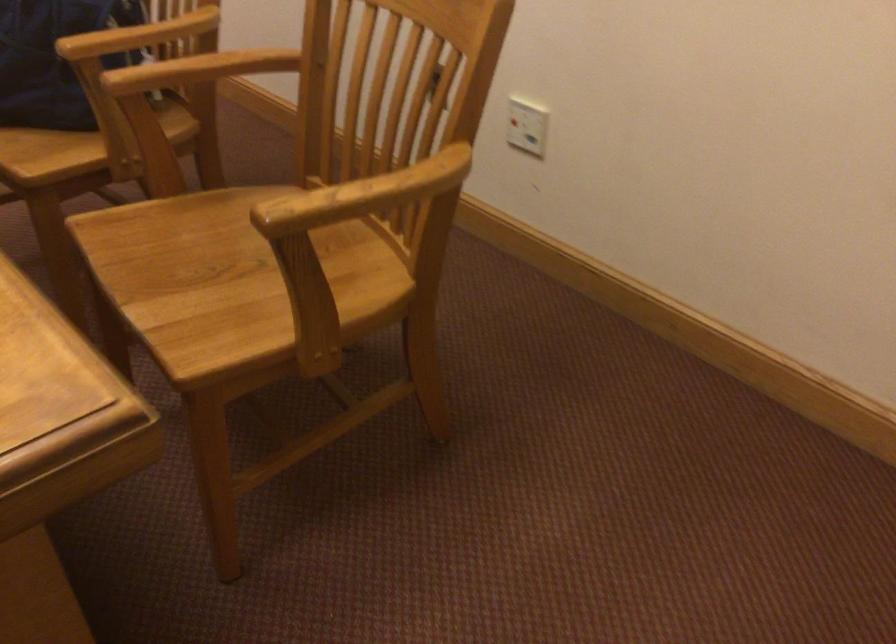
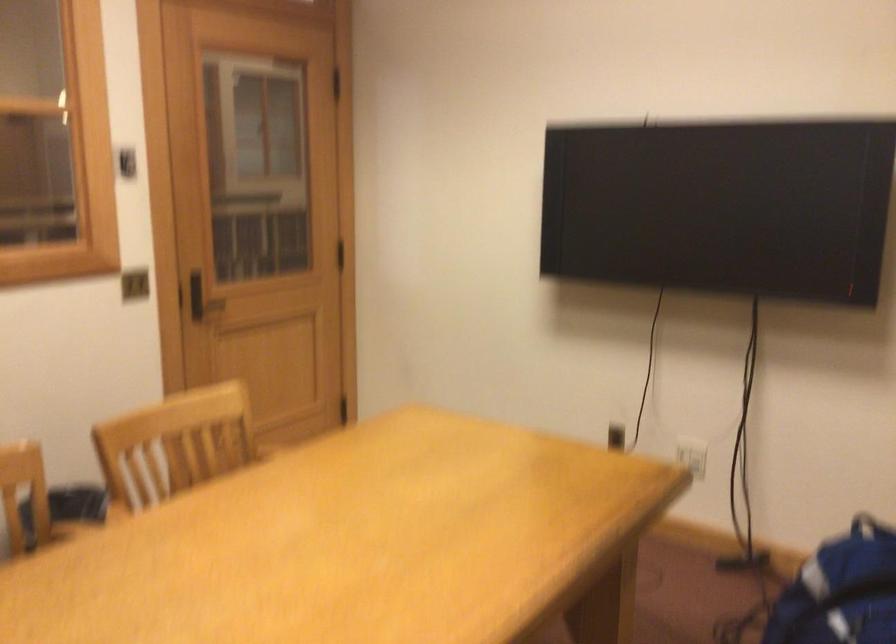
Question: The camera is either moving clockwise (left) or counter-clockwise (right) around the object. The first image is from the beginning of the video and the second image is from the end. Is the camera moving left or right when shooting the video?

Choices:
 (A) Left
 (B) Right

Answer: (B)